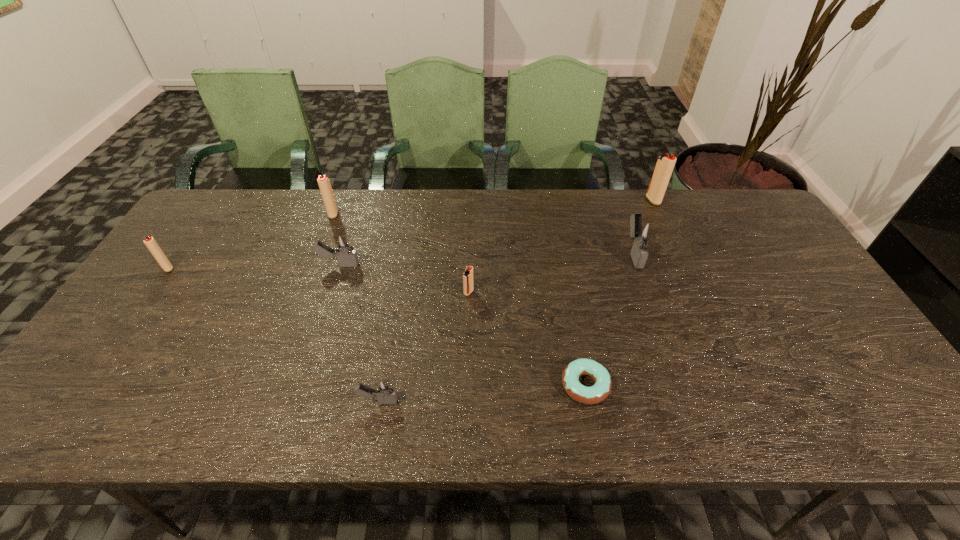
Where is `the fifth igniter from left to right`? The width and height of the screenshot is (960, 540). the fifth igniter from left to right is located at coordinates (468, 287).

This screenshot has width=960, height=540. Find the location of `the fourth igniter from left to right`. the fourth igniter from left to right is located at coordinates (384, 390).

Image resolution: width=960 pixels, height=540 pixels. In order to click on the second gray igniter from right to left in this screenshot , I will do (x=384, y=390).

This screenshot has height=540, width=960. Find the location of `blue doughnut`. blue doughnut is located at coordinates (601, 389).

Identify the location of the shortest object. The width and height of the screenshot is (960, 540). (601, 389).

This screenshot has height=540, width=960. What are the coordinates of `vacant space located 0.380m on the front of the rightmost red igniter` in the screenshot? It's located at (694, 290).

Locate an element on the screen. The width and height of the screenshot is (960, 540). vacant area situated 0.070m on the right of the second farthest igniter is located at coordinates (360, 214).

Where is `blank area located 0.100m on the back of the biggest gray igniter`? blank area located 0.100m on the back of the biggest gray igniter is located at coordinates (621, 217).

The width and height of the screenshot is (960, 540). In order to click on free region located on the back of the leftmost gray igniter in this screenshot , I will do `click(349, 231)`.

Image resolution: width=960 pixels, height=540 pixels. I want to click on vacant space located on the back of the third biggest red igniter, so click(197, 226).